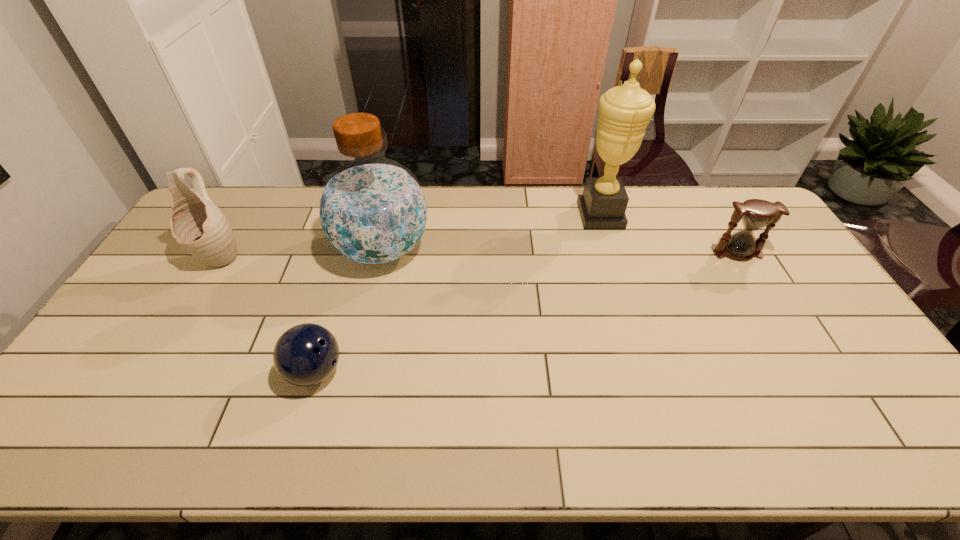
I want to click on vacant space located 0.310m at the front of the tallest object with handles, so click(x=491, y=215).

Locate an element on the screen. The width and height of the screenshot is (960, 540). vacant space located at the front of the tallest object with handles is located at coordinates (555, 215).

At what (x,y) coordinates should I click in order to perform the action: click on free region located on the front of the water jug. Please return your answer as a coordinate pair (x, y). Looking at the image, I should click on (368, 315).

At what (x,y) coordinates should I click in order to perform the action: click on vacant region located 0.190m at the spout of the pitcher. Please return your answer as a coordinate pair (x, y). This screenshot has width=960, height=540. Looking at the image, I should click on (180, 325).

Find the location of a particular element. free spot located on the front of the rightmost object is located at coordinates pos(804,367).

Find the location of a particular element. free space located 0.080m on the surface of the shortest object near the finger holes is located at coordinates (376, 372).

Identify the location of trophy cup that is at the far edge. (625, 111).

This screenshot has height=540, width=960. What are the coordinates of `water jug that is at the far edge` in the screenshot? It's located at (372, 211).

This screenshot has width=960, height=540. What are the coordinates of `object that is at the left edge` in the screenshot? It's located at (197, 224).

Locate an element on the screen. The image size is (960, 540). object present at the right edge is located at coordinates (755, 214).